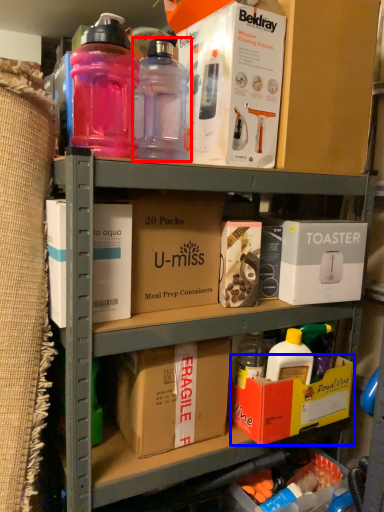
Question: Which object is further to the camera taking this photo, bottle (highlighted by a red box) or box (highlighted by a blue box)?

Choices:
 (A) bottle
 (B) box

Answer: (B)